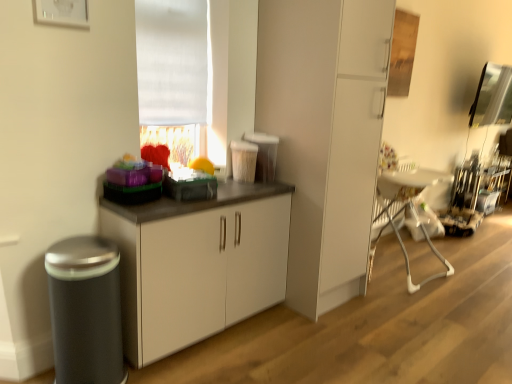
Question: From the image's perspective, is matte black toaster at center, arranged as the 2th appliance when viewed from the back, on top of metallic stainless steel coffee machine at right, which ranks as the third appliance in left-to-right order?

Choices:
 (A) yes
 (B) no

Answer: (A)

Question: Does matte black toaster at center, arranged as the 2th appliance when viewed from the back, have a greater width compared to metallic stainless steel coffee machine at right, positioned as the 1th appliance in right-to-left order?

Choices:
 (A) no
 (B) yes

Answer: (A)

Question: Can you confirm if matte black toaster at center, placed as the 2th appliance when sorted from front to back, is thinner than metallic stainless steel coffee machine at right, which ranks as the third appliance in left-to-right order?

Choices:
 (A) yes
 (B) no

Answer: (A)

Question: From the image's perspective, is matte black toaster at center, positioned as the 2th appliance in right-to-left order, located beneath metallic stainless steel coffee machine at right, which ranks as the third appliance in left-to-right order?

Choices:
 (A) yes
 (B) no

Answer: (B)

Question: Is matte black toaster at center, placed as the 2th appliance when sorted from front to back, far away from metallic stainless steel coffee machine at right, placed as the third appliance when sorted from front to back?

Choices:
 (A) no
 (B) yes

Answer: (B)

Question: Considering the positions of point (460, 201) and point (505, 71), is point (460, 201) closer or farther from the camera than point (505, 71)?

Choices:
 (A) closer
 (B) farther

Answer: (A)

Question: From a real-world perspective, is metallic stainless steel coffee machine at right, positioned as the 1th appliance in right-to-left order, above or below transparent glass window screen at upper right?

Choices:
 (A) below
 (B) above

Answer: (A)

Question: From the image's perspective, is metallic stainless steel coffee machine at right, placed as the third appliance when sorted from front to back, located above or below transparent glass window screen at upper right?

Choices:
 (A) above
 (B) below

Answer: (B)

Question: Is metallic stainless steel coffee machine at right, which ranks as the third appliance in left-to-right order, in front of or behind transparent glass window screen at upper right in the image?

Choices:
 (A) behind
 (B) front

Answer: (A)

Question: In terms of width, does matte black toaster at center, arranged as the 2th appliance when viewed from the back, look wider or thinner when compared to matte black trash can at left, the first appliance positioned from the front?

Choices:
 (A) wide
 (B) thin

Answer: (B)

Question: Would you say matte black toaster at center, arranged as the 2th appliance when viewed from the back, is to the left or to the right of matte black trash can at left, which is the first appliance from left to right, in the picture?

Choices:
 (A) left
 (B) right

Answer: (B)

Question: Is matte black toaster at center, which appears as the 2th appliance when viewed from the left, taller or shorter than matte black trash can at left, placed as the third appliance when sorted from right to left?

Choices:
 (A) short
 (B) tall

Answer: (A)

Question: Considering their positions, is matte black toaster at center, placed as the 2th appliance when sorted from front to back, located in front of or behind matte black trash can at left, placed as the third appliance when sorted from right to left?

Choices:
 (A) front
 (B) behind

Answer: (B)

Question: Is point (507, 117) positioned closer to the camera than point (166, 193)?

Choices:
 (A) farther
 (B) closer

Answer: (A)

Question: In the image, is transparent glass window screen at upper right on the left side or the right side of matte black toaster at center, positioned as the 2th appliance in right-to-left order?

Choices:
 (A) left
 (B) right

Answer: (B)